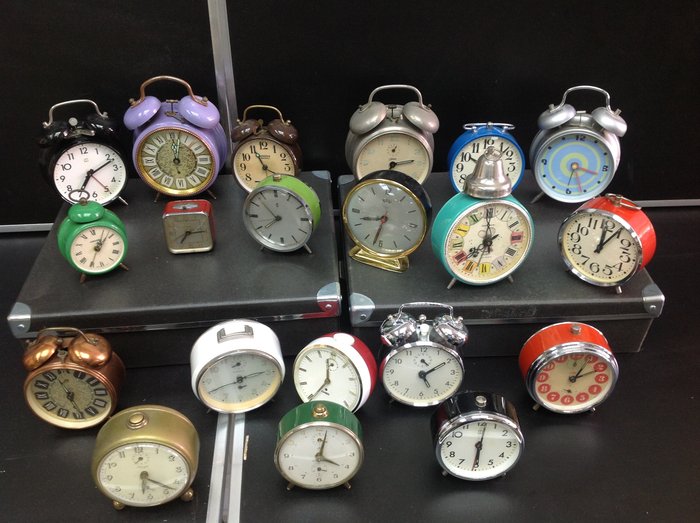
Find the location of a particular element. white clock is located at coordinates (248, 343).